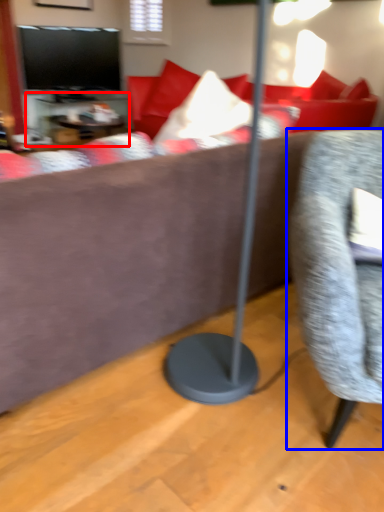
Question: Which object is closer to the camera taking this photo, table (highlighted by a red box) or chair (highlighted by a blue box)?

Choices:
 (A) table
 (B) chair

Answer: (B)